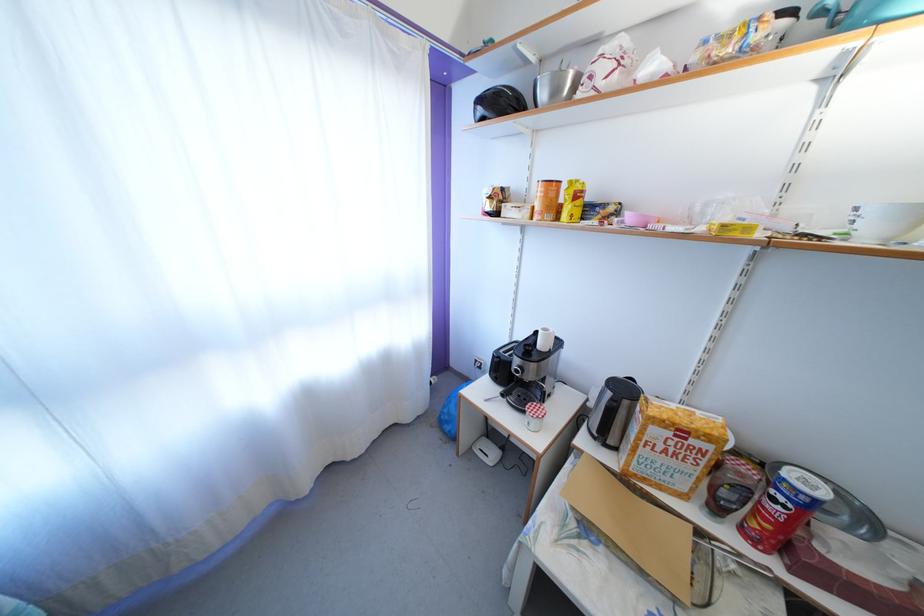
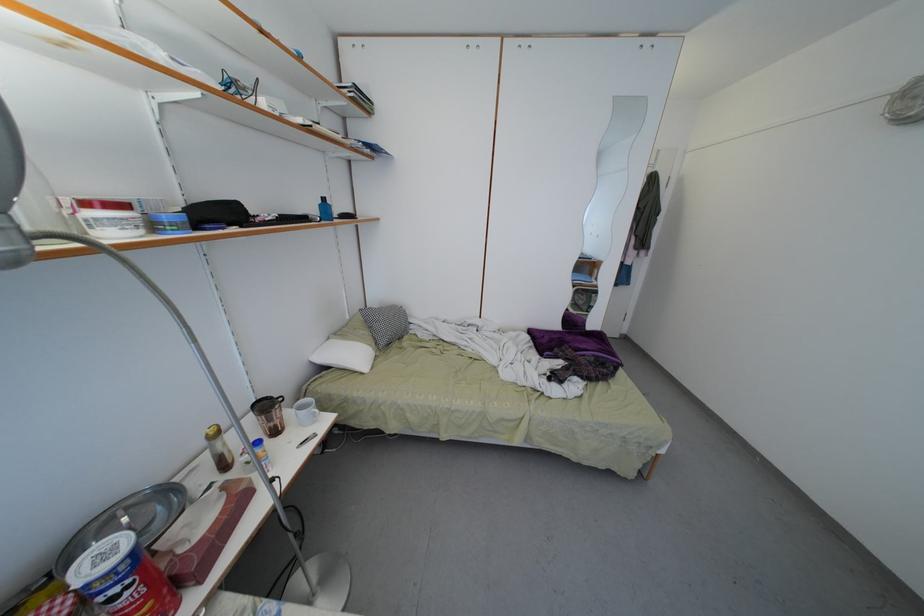
The point at (786, 505) is marked in the first image. Where is the corresponding point in the second image?

(120, 596)